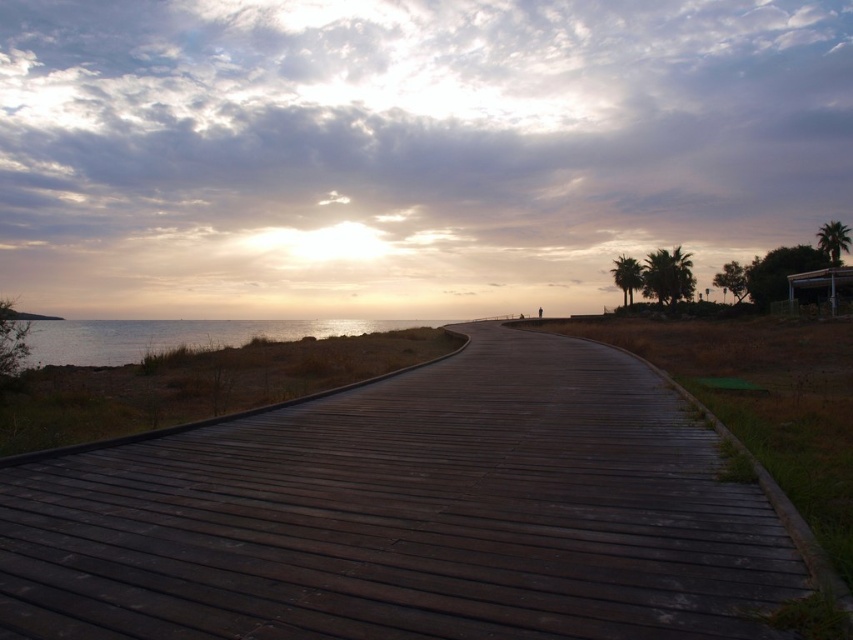
You are standing at the starting point of the dark brown wooden path at center. If you walk straight ahead along the path, which direction will you face when you reach the end of the path?

Since the dark brown wooden path at center is located at point (407, 515), walking straight ahead along the path would lead you towards the horizon, facing the direction where the sun is partially visible in the sky. The path curves gently towards the horizon, so your facing direction will align with the path curvature, likely facing east or west depending on the sun position during sunrise or sunset.